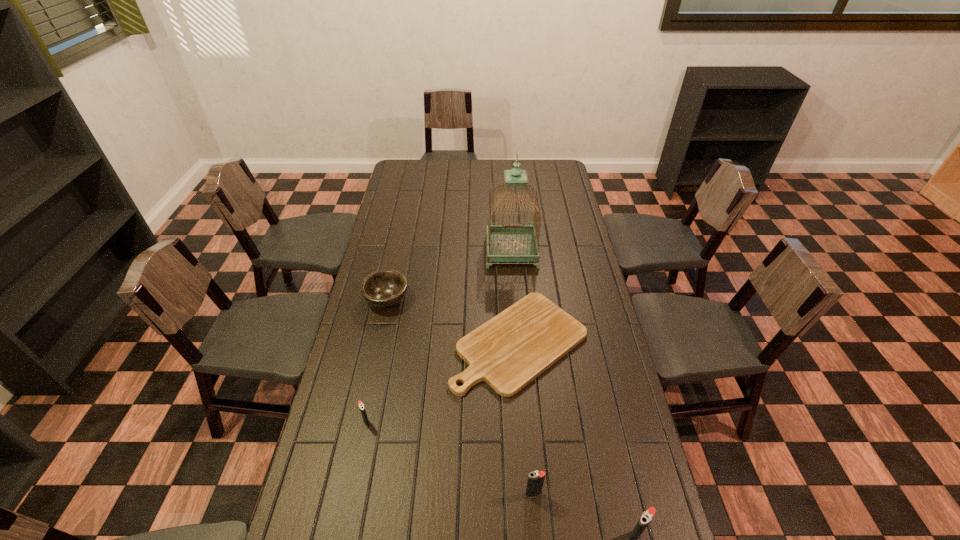
Identify which igniter is the closest to the farthest object. Please provide its 2D coordinates. Your answer should be formatted as a tuple, i.e. [(x, y)], where the tuple contains the x and y coordinates of a point satisfying the conditions above.

[(361, 405)]

Locate which igniter ranks second in proximity to the shortest object. Please provide its 2D coordinates. Your answer should be formatted as a tuple, i.e. [(x, y)], where the tuple contains the x and y coordinates of a point satisfying the conditions above.

[(535, 481)]

Where is `free space that satisfies the following two spatial constraints: 1. at the door of the tallest object; 2. on the left side of the chopping board`? free space that satisfies the following two spatial constraints: 1. at the door of the tallest object; 2. on the left side of the chopping board is located at coordinates (518, 342).

Find the location of a particular element. vacant area in the image that satisfies the following two spatial constraints: 1. on the front side of the second igniter from left to right; 2. on the right side of the shortest object is located at coordinates (532, 494).